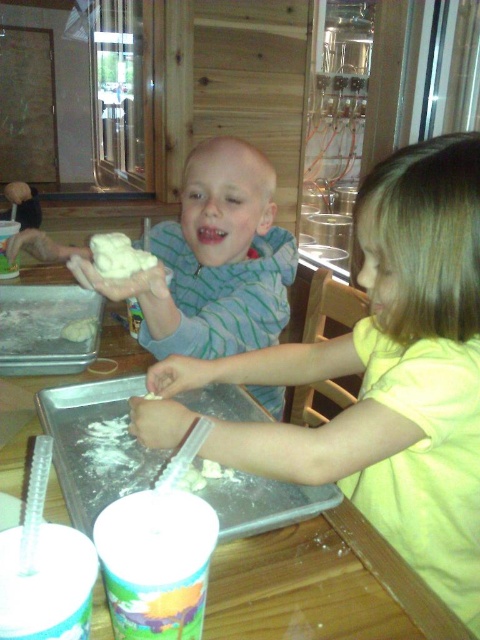
You are a child participating in a baking activity at the wooden table. You need to sprinkle some flour to prevent dough from sticking. Where should you reach to get the white flour at center?

You should reach the white flour at center located at point 0.516 on the x axis and 0.167 on the y axis.

You are a chef who needs to check the dough at the center. You are currently standing 24 inches away from the smooth white dough at center. Can you reach it without moving closer?

The smooth white dough at center and viewer are 24.68 inches apart from each other. Since you are 24 inches away, you are slightly closer than the distance required, so you can reach the smooth white dough at center without moving closer.